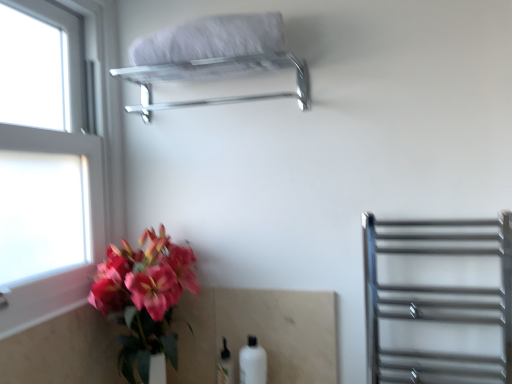
Question: Is point (302, 64) positioned closer to the camera than point (146, 56)?

Choices:
 (A) closer
 (B) farther

Answer: (B)

Question: Would you say polished chrome towel rack at upper center is to the left or to the right of white fluffy towel at upper center in the picture?

Choices:
 (A) left
 (B) right

Answer: (A)

Question: Estimate the real-world distances between objects in this image. Which object is closer to the polished chrome towel rack at upper center?

Choices:
 (A) white fluffy towel at upper center
 (B) white matte bottle at lower center, which ranks as the first bottle in left-to-right order
 (C) white glass window at left
 (D) polished chrome towel rack at right
 (E) white matte bottle at lower center, the second bottle from the left

Answer: (A)

Question: Considering the real-world distances, which object is farthest from the white matte bottle at lower center, the second bottle from the left?

Choices:
 (A) white fluffy towel at upper center
 (B) polished chrome towel rack at upper center
 (C) white glass window at left
 (D) polished chrome towel rack at right
 (E) white matte bottle at lower center, the 2th bottle positioned from the right

Answer: (A)